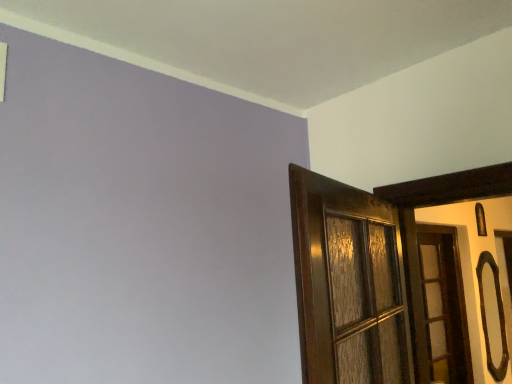
Question: Should I look upward or downward to see black glossy door handle at right?

Choices:
 (A) up
 (B) down

Answer: (B)

Question: From a real-world perspective, is wooden door at right on black glossy door handle at right?

Choices:
 (A) yes
 (B) no

Answer: (A)

Question: Is wooden door at right wider than black glossy door handle at right?

Choices:
 (A) no
 (B) yes

Answer: (B)

Question: Considering the relative sizes of wooden door at right and black glossy door handle at right in the image provided, is wooden door at right smaller than black glossy door handle at right?

Choices:
 (A) no
 (B) yes

Answer: (A)

Question: Is wooden door at right to the left of black glossy door handle at right from the viewer's perspective?

Choices:
 (A) no
 (B) yes

Answer: (B)

Question: Considering the relative sizes of wooden door at right and black glossy door handle at right in the image provided, is wooden door at right taller than black glossy door handle at right?

Choices:
 (A) yes
 (B) no

Answer: (A)

Question: Is wooden door at right completely or partially outside of black glossy door handle at right?

Choices:
 (A) yes
 (B) no

Answer: (A)

Question: Would you say black glossy door handle at right contains wooden door at right?

Choices:
 (A) yes
 (B) no

Answer: (B)

Question: Can you confirm if black glossy door handle at right is positioned to the right of wooden door at right?

Choices:
 (A) no
 (B) yes

Answer: (B)

Question: Are black glossy door handle at right and wooden door at right located far from each other?

Choices:
 (A) no
 (B) yes

Answer: (A)

Question: From the image's perspective, does black glossy door handle at right appear lower than wooden door at right?

Choices:
 (A) yes
 (B) no

Answer: (A)

Question: Does black glossy door handle at right have a smaller size compared to wooden door at right?

Choices:
 (A) no
 (B) yes

Answer: (B)

Question: From a real-world perspective, is black glossy door handle at right located beneath wooden door at right?

Choices:
 (A) yes
 (B) no

Answer: (A)

Question: From a real-world perspective, is black glossy door handle at right positioned above or below wooden door at right?

Choices:
 (A) above
 (B) below

Answer: (B)